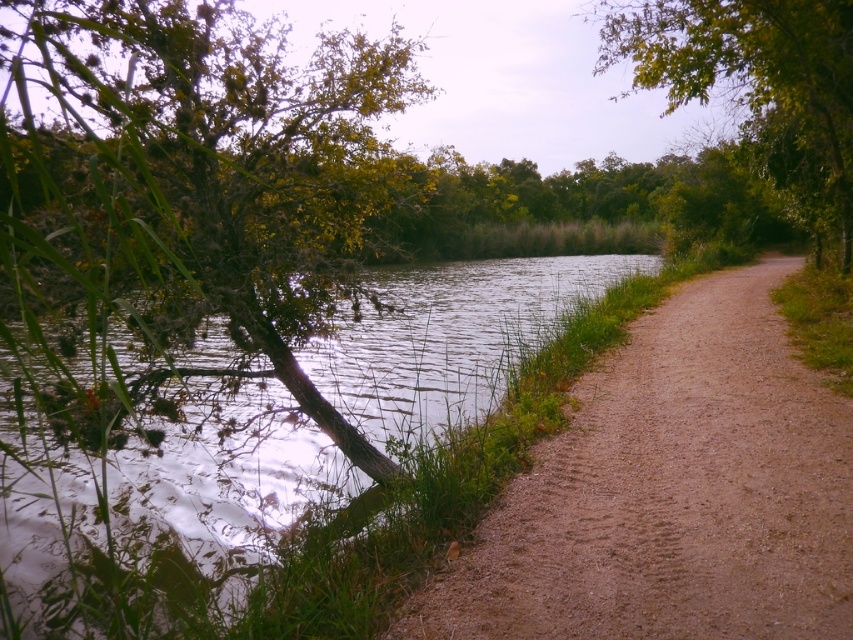
What do you see at coordinates (671, 492) in the screenshot? The width and height of the screenshot is (853, 640). I see `dirt/gravel path at center` at bounding box center [671, 492].

The width and height of the screenshot is (853, 640). Find the location of `dirt/gravel path at center`. dirt/gravel path at center is located at coordinates (671, 492).

Between green leafy tree at left and green leafy tree at upper right, which one has more height?

green leafy tree at upper right is taller.

Is the position of green leafy tree at left less distant than that of green leafy tree at upper right?

→ Yes, it is in front of green leafy tree at upper right.

Is point (51, 33) positioned behind point (752, 125)?

That is False.

The width and height of the screenshot is (853, 640). In order to click on green leafy tree at left in this screenshot , I will do click(x=186, y=192).

Can you confirm if green leafy tree at left is shorter than green grassy river at lower left?

Incorrect, green leafy tree at left's height does not fall short of green grassy river at lower left's.

Between green leafy tree at left and green grassy river at lower left, which one appears on the left side from the viewer's perspective?

green leafy tree at left

Measure the distance between green leafy tree at left and camera.

green leafy tree at left and camera are 7.34 feet apart from each other.

You are a GUI agent. You are given a task and a screenshot of the screen. Output one action in this format:
    pyautogui.click(x=<x>, y=<y>)
    Task: Click on the green leafy tree at left
    The height and width of the screenshot is (640, 853).
    Given the screenshot: What is the action you would take?
    pyautogui.click(x=186, y=192)